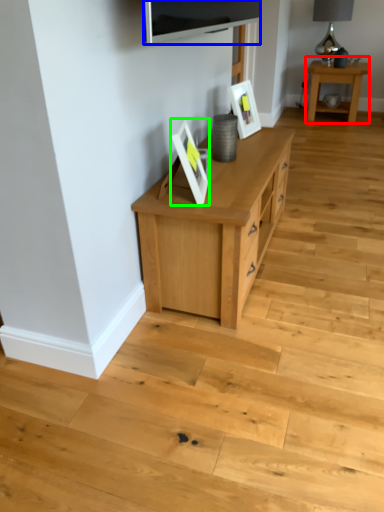
Question: Based on their relative distances, which object is farther from table (highlighted by a red box)? Choose from television (highlighted by a blue box) and picture frame (highlighted by a green box).

Choices:
 (A) television
 (B) picture frame

Answer: (B)